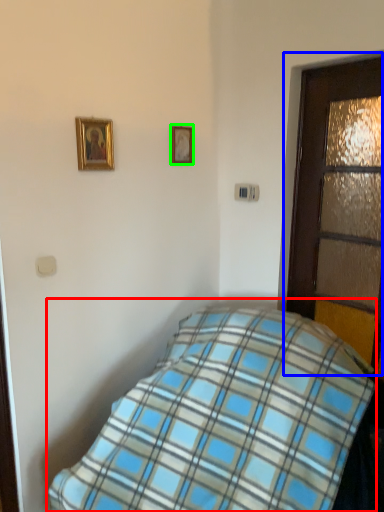
Question: Considering the real-world distances, which object is closest to bed (highlighted by a red box)? door (highlighted by a blue box) or picture frame (highlighted by a green box).

Choices:
 (A) door
 (B) picture frame

Answer: (A)